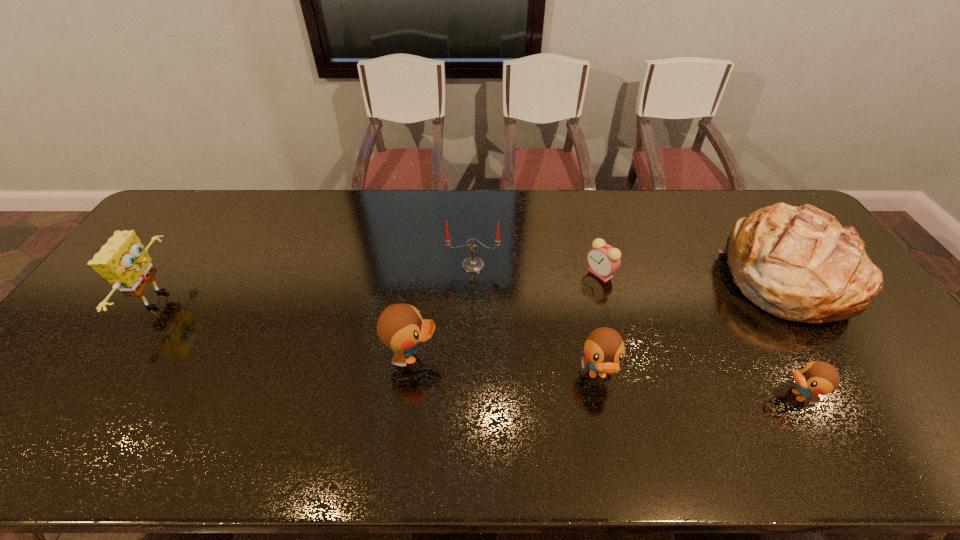
The height and width of the screenshot is (540, 960). I want to click on the tallest duck, so click(x=400, y=327).

Where is `the second tallest duck`? the second tallest duck is located at coordinates (604, 348).

Identify the location of the third shortest object. This screenshot has width=960, height=540. (604, 348).

What are the coordinates of `the rightmost duck` in the screenshot? It's located at (815, 378).

The height and width of the screenshot is (540, 960). I want to click on candle, so click(472, 264).

Image resolution: width=960 pixels, height=540 pixels. In order to click on bread in this screenshot , I will do `click(798, 263)`.

At what (x,y) coordinates should I click in order to perform the action: click on sponge. Please return your answer as a coordinate pair (x, y). The image size is (960, 540). Looking at the image, I should click on (123, 261).

Find the location of a particular element. The height and width of the screenshot is (540, 960). alarm clock is located at coordinates (603, 259).

Image resolution: width=960 pixels, height=540 pixels. Identify the location of free location located 0.220m on the front-facing side of the leftmost duck. coord(525,356).

This screenshot has height=540, width=960. I want to click on blank space located 0.260m on the front-facing side of the shortest duck, so click(669, 395).